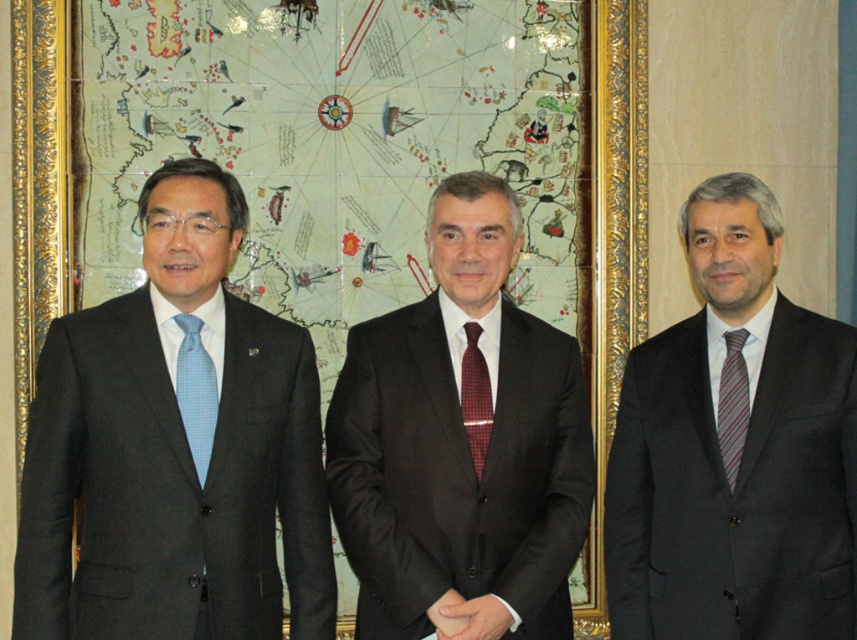
You are a photographer setting up for a group photo. You need to ensure that all subjects are visible in the frame. Given that the matte black suit at left and the light blue textured tie at left are part of the same person, which item should you focus on to ensure the entire person is captured?

The matte black suit at left has a larger width than the light blue textured tie at left. Therefore, focusing on the matte black suit at left will ensure the entire person is captured as it encompasses the wider area of the person.

Based on the photo, you are a photographer who needs to capture a clear shot of both the dark gray suit at center and the light blue textured tie at left. Since you want to ensure both are in focus, you need to know their relative heights. Which one is taller?

The dark gray suit at center is taller than the light blue textured tie at left.